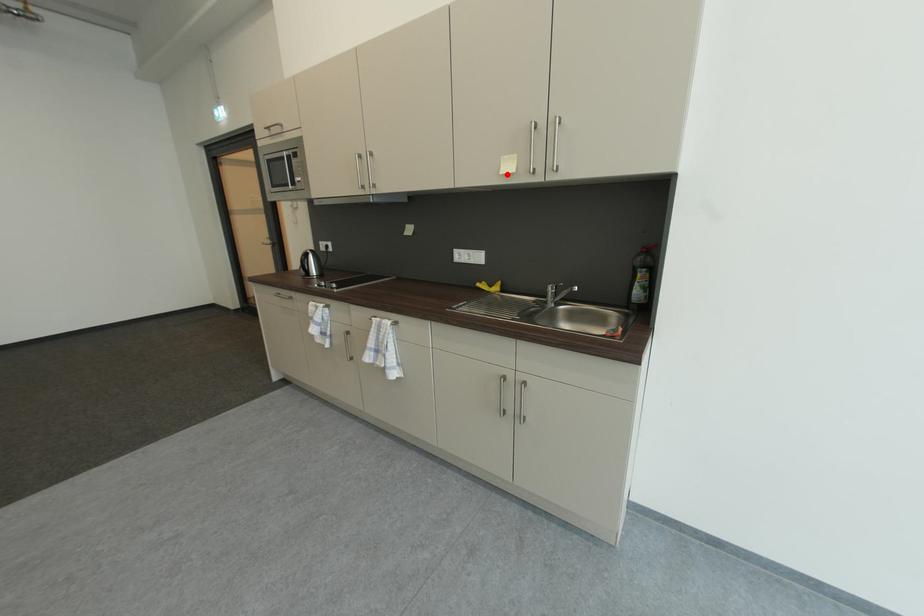
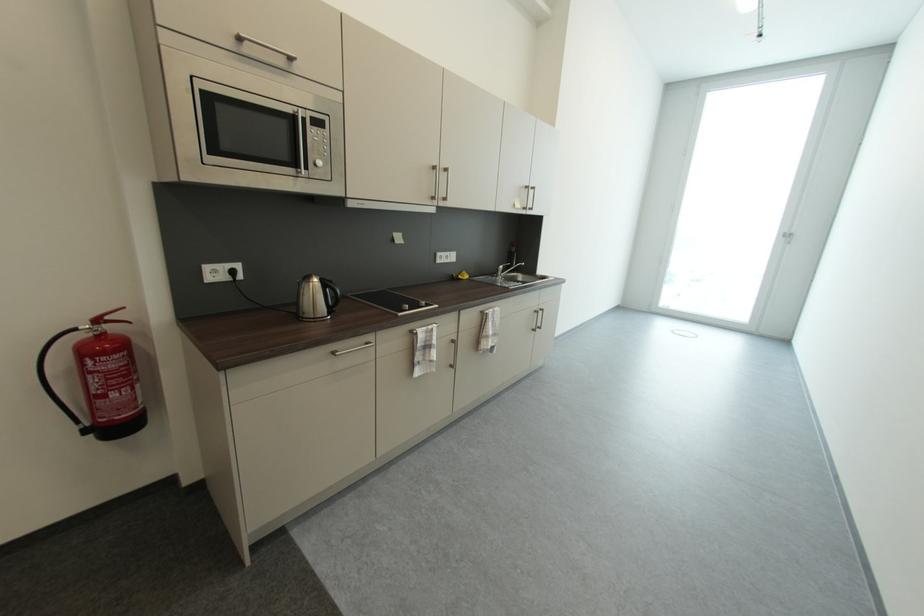
Locate, in the second image, the point that corresponds to the highlighted location in the first image.

(523, 209)